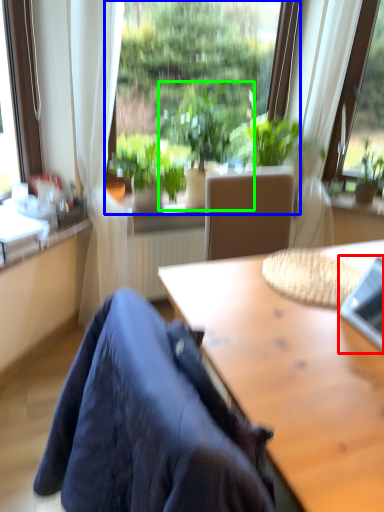
Question: Considering the real-world distances, which object is closest to laptop (highlighted by a red box)? window (highlighted by a blue box) or houseplant (highlighted by a green box).

Choices:
 (A) window
 (B) houseplant

Answer: (B)